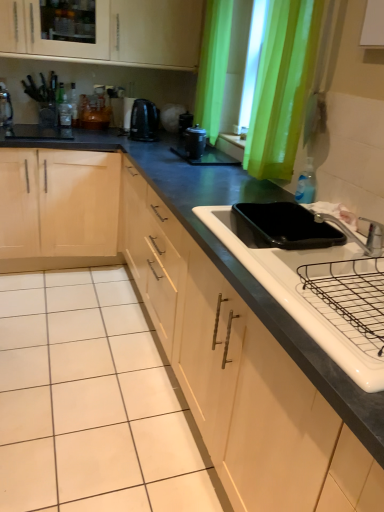
Question: Is matte black coffee maker at center taller than silver metallic faucet at upper right?

Choices:
 (A) yes
 (B) no

Answer: (A)

Question: Does matte black coffee maker at center have a smaller size compared to silver metallic faucet at upper right?

Choices:
 (A) no
 (B) yes

Answer: (B)

Question: From a real-world perspective, is matte black coffee maker at center below silver metallic faucet at upper right?

Choices:
 (A) no
 (B) yes

Answer: (A)

Question: Is matte black coffee maker at center oriented towards silver metallic faucet at upper right?

Choices:
 (A) no
 (B) yes

Answer: (A)

Question: Could silver metallic faucet at upper right be considered to be inside matte black coffee maker at center?

Choices:
 (A) no
 (B) yes

Answer: (A)

Question: From the image's perspective, is matte black coffee maker at center on silver metallic faucet at upper right?

Choices:
 (A) no
 (B) yes

Answer: (B)

Question: Can you confirm if clear glass bottle at upper left, positioned as the 2th bottle in bottom-to-top order, is positioned to the right of white glossy sink at lower right?

Choices:
 (A) yes
 (B) no

Answer: (B)

Question: Does clear glass bottle at upper left, which is the second bottle from front to back, have a larger size compared to white glossy sink at lower right?

Choices:
 (A) yes
 (B) no

Answer: (B)

Question: Is clear glass bottle at upper left, the first bottle from the left, to the left of white glossy sink at lower right from the viewer's perspective?

Choices:
 (A) no
 (B) yes

Answer: (B)

Question: Is white glossy sink at lower right at the back of clear glass bottle at upper left, positioned as the 2th bottle in bottom-to-top order?

Choices:
 (A) yes
 (B) no

Answer: (B)

Question: Can you confirm if clear glass bottle at upper left, positioned as the first bottle in back-to-front order, is wider than white glossy sink at lower right?

Choices:
 (A) no
 (B) yes

Answer: (A)

Question: Is clear glass bottle at upper left, positioned as the 2th bottle in bottom-to-top order, in front of white glossy sink at lower right?

Choices:
 (A) yes
 (B) no

Answer: (B)

Question: Could you tell me if silver metallic faucet at upper right is turned towards blue translucent bottle at sink right, the second bottle from the top?

Choices:
 (A) no
 (B) yes

Answer: (A)